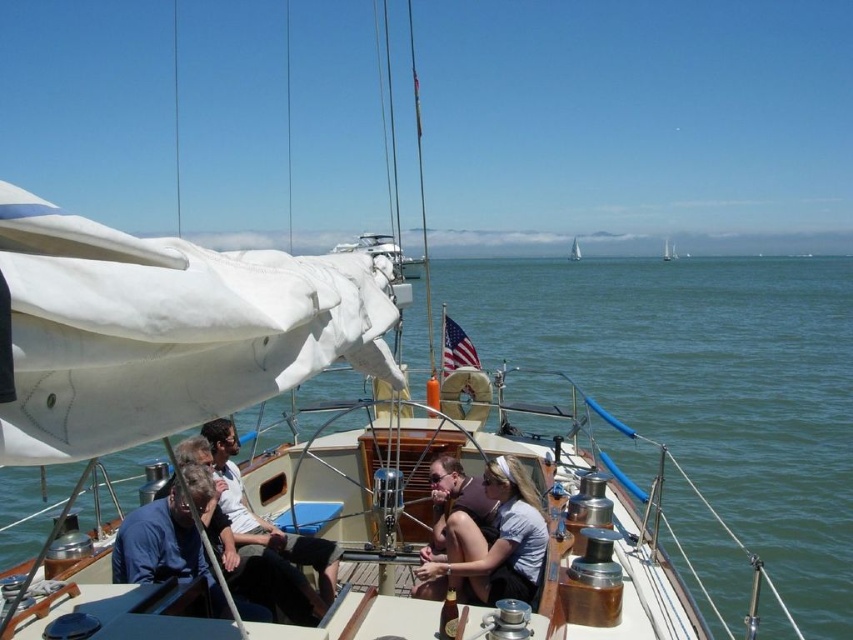
In the scene shown: You are a passenger on the sailboat and want to know if the matte brown hair at center is visible above the white cotton shirt at center. According to the scene, is this true?

The matte brown hair at center is located below the white cotton shirt at center, so it is not visible above the white cotton shirt at center.

You are a sailor trying to determine which sail is better suited for today. You see the white matte sailboat at center and the white canvas sailboat at center. Which one has a taller sail?

The white matte sailboat at center is much taller as white canvas sailboat at center, so the white matte sailboat at center has a taller sail.

You are a sailor trying to choose between two sailboats anchored at the harbor. You notice the white matte sailboat at center and the white canvas sailboat at center. Which one has a narrower width?

The white matte sailboat at center has a narrower width than the white canvas sailboat at center according to the description.